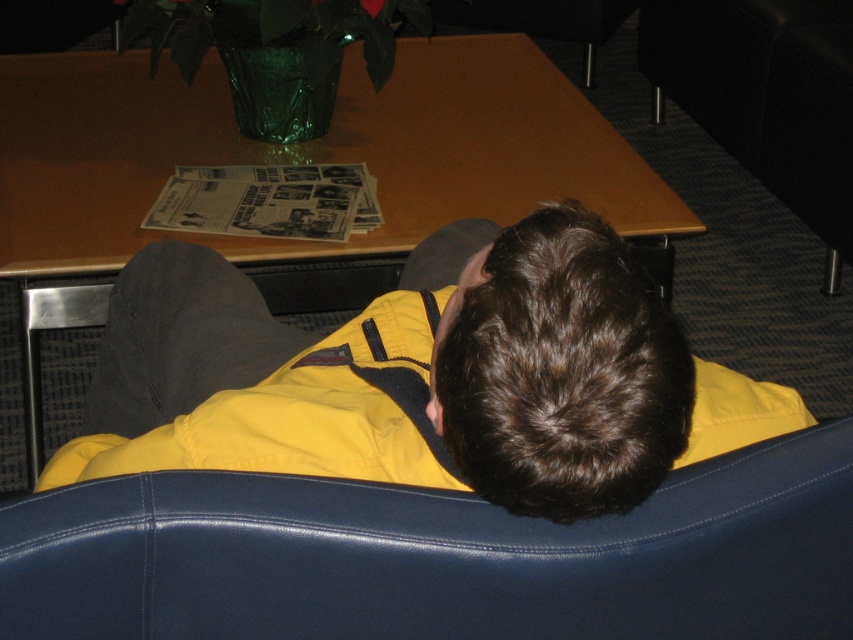
Question: Is leather-like blue armchair at center to the right of dark brown hair at center from the viewer's perspective?

Choices:
 (A) no
 (B) yes

Answer: (A)

Question: Does leather-like blue armchair at center have a smaller size compared to black leather couch at lower right?

Choices:
 (A) yes
 (B) no

Answer: (A)

Question: Which is nearer to the black leather couch at lower right?

Choices:
 (A) dark brown hair at center
 (B) leather-like blue armchair at center

Answer: (A)

Question: Which point is farther to the camera?

Choices:
 (A) (611, 426)
 (B) (547, 582)
 (C) (796, 112)
 (D) (502, 147)

Answer: (C)

Question: Which of the following is the closest to the observer?

Choices:
 (A) wooden table at center
 (B) dark brown hair at center
 (C) leather-like blue armchair at center
 (D) black leather couch at lower right

Answer: (C)

Question: Does leather-like blue armchair at center lie in front of wooden table at center?

Choices:
 (A) no
 (B) yes

Answer: (B)